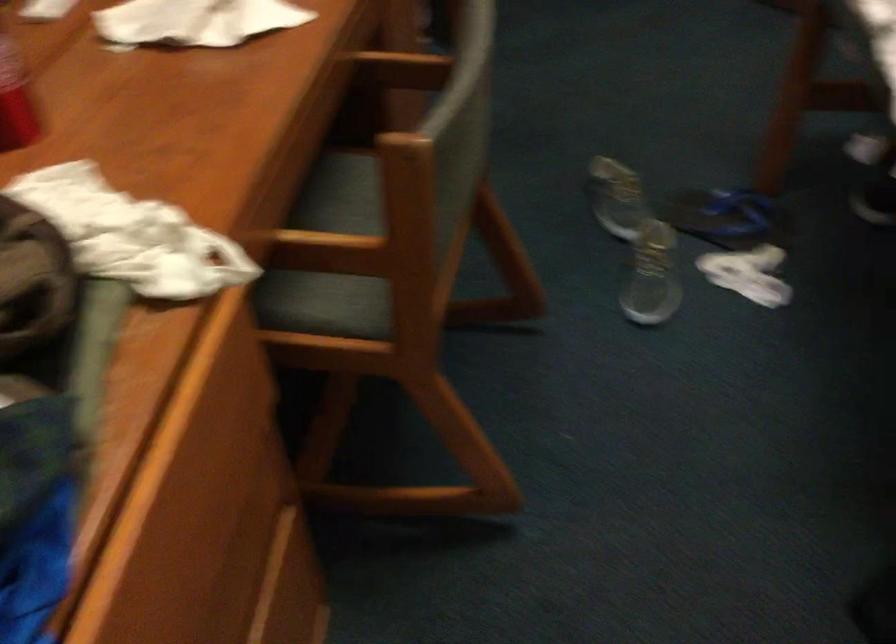
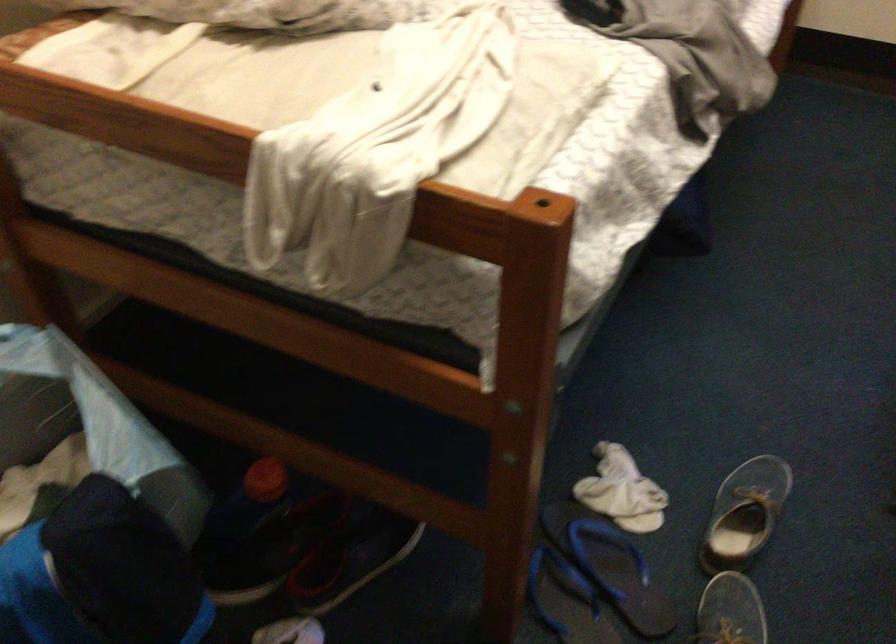
In the second image, find the point that corresponds to point 649,259 in the first image.

(745, 514)